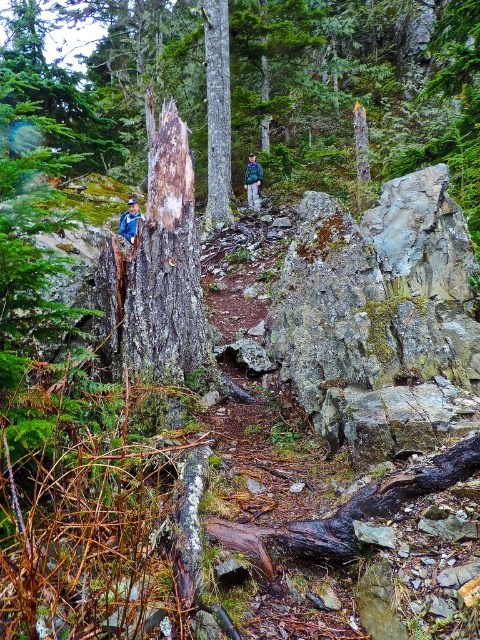
In the scene shown: You are a hiker who wants to place your green fabric jacket at center on top of the gray mossy rock at upper center. Based on the scene, will the jacket fit on the rock?

The gray mossy rock at upper center is larger in size than the green fabric jacket at center, so the jacket will fit on the rock.

You are a hiker carrying a backpack and need to place your green fabric jacket at center onto the gray mossy rock at upper center. Can you reach the jacket from your current position without moving closer to it?

The gray mossy rock at upper center is 8.65 meters away from the green fabric jacket at center. Since the jacket is already placed on the rock, you don not need to move closer to reach it.